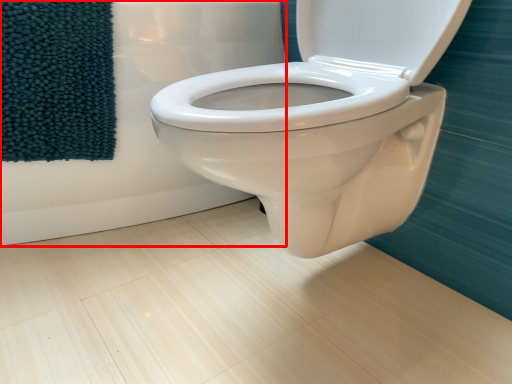
Question: Observing the image, what is the correct spatial positioning of bath (annotated by the red box) in reference to beach towel?

Choices:
 (A) right
 (B) left

Answer: (A)